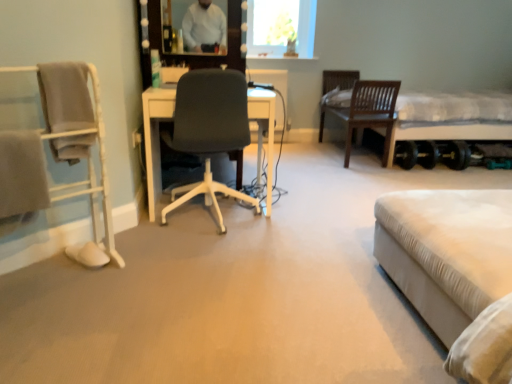
Question: Does transparent glass vase at upper center have a greater width compared to white fabric bed at right, arranged as the 2th bed when viewed from the left?

Choices:
 (A) no
 (B) yes

Answer: (A)

Question: Is transparent glass vase at upper center looking in the opposite direction of white fabric bed at right, which is the 2th bed in front-to-back order?

Choices:
 (A) yes
 (B) no

Answer: (B)

Question: Does transparent glass vase at upper center appear on the left side of white fabric bed at right, arranged as the 2th bed when viewed from the left?

Choices:
 (A) no
 (B) yes

Answer: (B)

Question: Does transparent glass vase at upper center have a smaller size compared to white fabric bed at right, the 1th bed positioned from the top?

Choices:
 (A) yes
 (B) no

Answer: (A)

Question: Considering the relative sizes of transparent glass vase at upper center and white fabric bed at right, the 2th bed from the bottom, in the image provided, is transparent glass vase at upper center taller than white fabric bed at right, the 2th bed from the bottom,?

Choices:
 (A) no
 (B) yes

Answer: (A)

Question: Is transparent glass vase at upper center not inside white fabric bed at right, the 1th bed positioned from the top?

Choices:
 (A) no
 (B) yes

Answer: (B)

Question: Is there a large distance between white fabric bed at lower right, which ranks as the 1th bed in bottom-to-top order, and transparent glass vase at upper center?

Choices:
 (A) no
 (B) yes

Answer: (B)

Question: Is white fabric bed at lower right, the first bed when ordered from front to back, at the right side of transparent glass vase at upper center?

Choices:
 (A) yes
 (B) no

Answer: (A)

Question: Does white fabric bed at lower right, the second bed from the back, have a smaller size compared to transparent glass vase at upper center?

Choices:
 (A) yes
 (B) no

Answer: (B)

Question: Can you confirm if white fabric bed at lower right, placed as the 1th bed when sorted from left to right, is taller than transparent glass vase at upper center?

Choices:
 (A) yes
 (B) no

Answer: (A)

Question: Is white fabric bed at lower right, placed as the 1th bed when sorted from left to right, outside transparent glass vase at upper center?

Choices:
 (A) yes
 (B) no

Answer: (A)

Question: Is white fabric bed at lower right, which ranks as the 1th bed in bottom-to-top order, thinner than transparent glass vase at upper center?

Choices:
 (A) yes
 (B) no

Answer: (B)

Question: Is white fabric bed at right, the 2th bed from the bottom, to the right of white fabric bed at lower right, the second bed from the back, from the viewer's perspective?

Choices:
 (A) yes
 (B) no

Answer: (A)